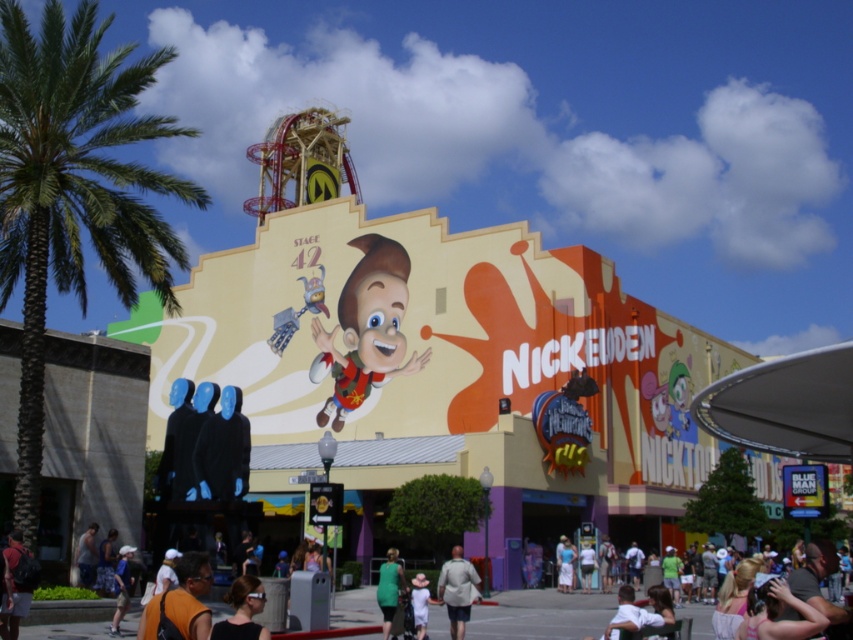
Is green leafy palm tree at left in front of black matte jacket at center?

Yes, it is.

I want to click on green leafy palm tree at left, so click(x=73, y=189).

Measure the distance between green leafy palm tree at left and camera.

green leafy palm tree at left is 39.38 meters from camera.

Identify the location of green leafy palm tree at left. (73, 189).

Is blonde hair at lower center bigger than white fabric shirt at lower center?

Yes, blonde hair at lower center is bigger than white fabric shirt at lower center.

Which is behind, point (252, 579) or point (173, 586)?

The point (173, 586) is more distant.

Image resolution: width=853 pixels, height=640 pixels. Identify the location of blonde hair at lower center. (242, 611).

In the scene shown: Does green matte dress at lower center have a lesser height compared to dark blue jeans at lower left?

In fact, green matte dress at lower center may be taller than dark blue jeans at lower left.

What do you see at coordinates (389, 588) in the screenshot? The image size is (853, 640). I see `green matte dress at lower center` at bounding box center [389, 588].

This screenshot has height=640, width=853. In order to click on green matte dress at lower center in this screenshot , I will do `click(389, 588)`.

Locate an element on the screen. Image resolution: width=853 pixels, height=640 pixels. green matte dress at lower center is located at coordinates (389, 588).